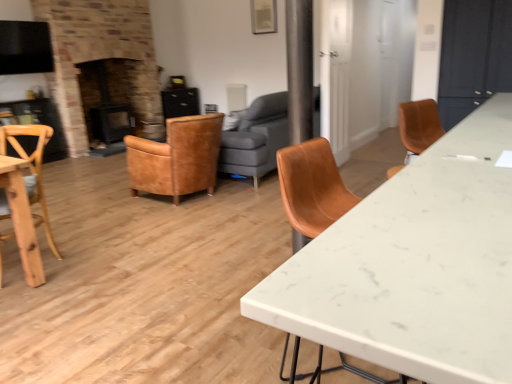
Question: From the image's perspective, is leather armchair at center, the 2th chair in the left-to-right sequence, located above or below natural wood chair at left, the first chair in the left-to-right sequence?

Choices:
 (A) above
 (B) below

Answer: (A)

Question: In terms of size, does leather armchair at center, which ranks as the 1th chair in right-to-left order, appear bigger or smaller than natural wood chair at left, which ranks as the first chair in front-to-back order?

Choices:
 (A) big
 (B) small

Answer: (A)

Question: Estimate the real-world distances between objects in this image. Which object is farther from the leather couch at center?

Choices:
 (A) white marble desk at center
 (B) natural wood chair at left, the second chair in the back-to-front sequence
 (C) leather armchair at center, the 2th chair in the left-to-right sequence
 (D) black glossy exhaust hood at upper left
 (E) black matte fireplace at left

Answer: (D)

Question: Which is nearer to the black glossy exhaust hood at upper left?

Choices:
 (A) leather armchair at center, the 2th chair in the left-to-right sequence
 (B) natural wood chair at left, which ranks as the first chair in front-to-back order
 (C) leather couch at center
 (D) black matte fireplace at left
 (E) white marble desk at center

Answer: (D)